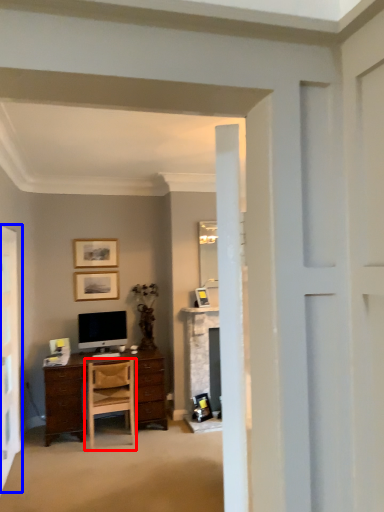
Question: Which of the following is the farthest to the observer, chair (highlighted by a red box) or screen door (highlighted by a blue box)?

Choices:
 (A) chair
 (B) screen door

Answer: (A)